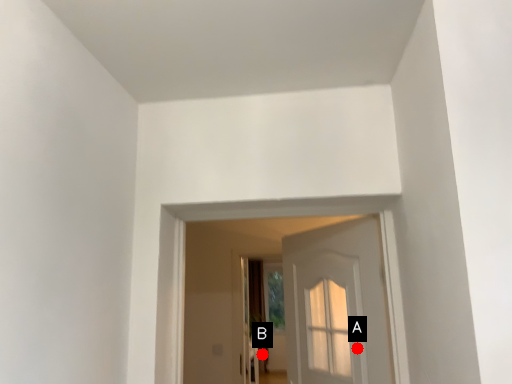
Question: Two points are circled on the image, labeled by A and B beside each circle. Which point is farther to the camera?

Choices:
 (A) A is further
 (B) B is further

Answer: (B)